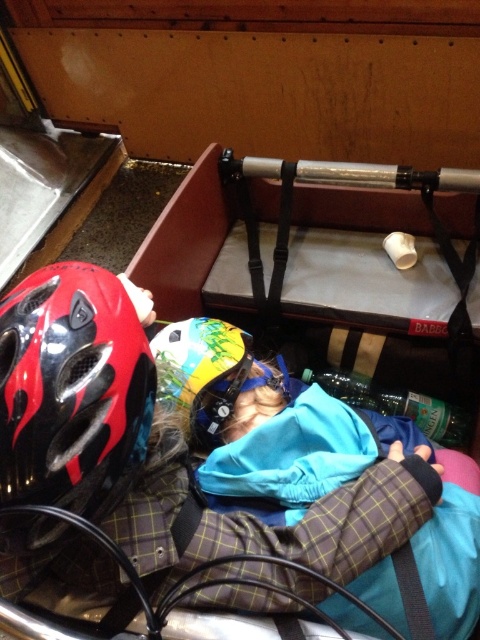
Describe the element at coordinates (72, 388) in the screenshot. I see `shiny red helmet at left` at that location.

Who is positioned more to the left, shiny red helmet at left or multicolored glossy helmet at center?

Positioned to the left is shiny red helmet at left.

What do you see at coordinates (72, 388) in the screenshot? This screenshot has height=640, width=480. I see `shiny red helmet at left` at bounding box center [72, 388].

You are a GUI agent. You are given a task and a screenshot of the screen. Output one action in this format:
    pyautogui.click(x=<x>, y=<y>)
    Task: Click on the shiny red helmet at left
    The image size is (480, 640).
    Given the screenshot: What is the action you would take?
    pyautogui.click(x=72, y=388)

Which is more to the left, plaid fabric sleeping bag at center or multicolored glossy helmet at center?

From the viewer's perspective, multicolored glossy helmet at center appears more on the left side.

Which is behind, point (296, 492) or point (230, 371)?

The point (230, 371) is behind.

Identify the location of plaid fabric sleeping bag at center. (264, 424).

Is plaid fabric sleeping bag at center positioned at the back of shiny red helmet at left?

Yes.

Between point (226, 340) and point (84, 349), which one is positioned behind?

The point (226, 340) is more distant.

What do you see at coordinates (264, 424) in the screenshot?
I see `plaid fabric sleeping bag at center` at bounding box center [264, 424].

At what (x,y) coordinates should I click in order to perform the action: click on plaid fabric sleeping bag at center. Please return your answer as a coordinate pair (x, y). The width and height of the screenshot is (480, 640). Looking at the image, I should click on (264, 424).